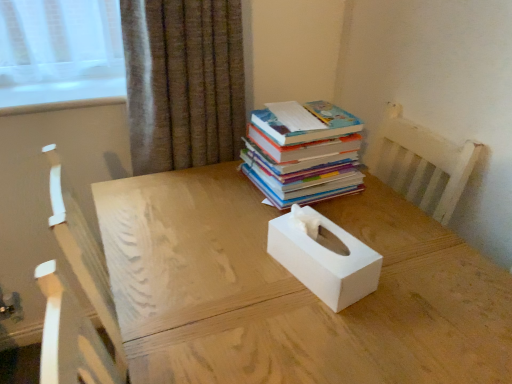
Question: Does white matte tissue box at center come in front of brown textured curtain at upper center?

Choices:
 (A) yes
 (B) no

Answer: (A)

Question: Does white matte tissue box at center have a larger size compared to brown textured curtain at upper center?

Choices:
 (A) yes
 (B) no

Answer: (A)

Question: Is the position of white matte tissue box at center more distant than that of brown textured curtain at upper center?

Choices:
 (A) yes
 (B) no

Answer: (B)

Question: Is white matte tissue box at center to the right of brown textured curtain at upper center from the viewer's perspective?

Choices:
 (A) yes
 (B) no

Answer: (A)

Question: Considering the relative sizes of white matte tissue box at center and brown textured curtain at upper center in the image provided, is white matte tissue box at center thinner than brown textured curtain at upper center?

Choices:
 (A) yes
 (B) no

Answer: (B)

Question: Relative to brown textured curtain at upper center, is white matte tissue box at center in front or behind?

Choices:
 (A) front
 (B) behind

Answer: (A)

Question: Is point (335, 289) closer or farther from the camera than point (170, 66)?

Choices:
 (A) farther
 (B) closer

Answer: (B)

Question: Based on their positions, is white matte tissue box at center located to the left or right of brown textured curtain at upper center?

Choices:
 (A) left
 (B) right

Answer: (B)

Question: From a real-world perspective, is white matte tissue box at center above or below brown textured curtain at upper center?

Choices:
 (A) below
 (B) above

Answer: (A)

Question: Based on their positions, is brown textured curtain at upper center located to the left or right of white matte tissue box at center?

Choices:
 (A) left
 (B) right

Answer: (A)

Question: Does point (224, 109) appear closer or farther from the camera than point (325, 279)?

Choices:
 (A) farther
 (B) closer

Answer: (A)

Question: From a real-world perspective, is brown textured curtain at upper center positioned above or below white matte tissue box at center?

Choices:
 (A) above
 (B) below

Answer: (A)

Question: Looking at their shapes, would you say brown textured curtain at upper center is wider or thinner than white matte tissue box at center?

Choices:
 (A) wide
 (B) thin

Answer: (A)

Question: Is point (266, 135) closer or farther from the camera than point (196, 14)?

Choices:
 (A) closer
 (B) farther

Answer: (A)

Question: From the image's perspective, is hardcover books at upper right above or below brown textured curtain at upper center?

Choices:
 (A) below
 (B) above

Answer: (A)